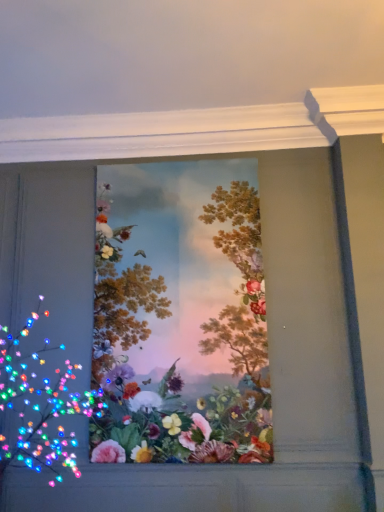
Question: From a real-world perspective, is vibrant floral bouquet at center, the 2th flower when ordered from front to back, over matte floral arrangement at left, which is counted as the first flower, starting from the front?

Choices:
 (A) yes
 (B) no

Answer: (A)

Question: Is vibrant floral bouquet at center, positioned as the 1th flower in back-to-front order, looking in the opposite direction of matte floral arrangement at left, which is the second flower from back to front?

Choices:
 (A) no
 (B) yes

Answer: (A)

Question: Can you confirm if vibrant floral bouquet at center, positioned as the 1th flower in back-to-front order, is wider than matte floral arrangement at left, which is counted as the first flower, starting from the front?

Choices:
 (A) yes
 (B) no

Answer: (B)

Question: Is vibrant floral bouquet at center, the 2th flower when ordered from front to back, at the right side of matte floral arrangement at left, which is the second flower from back to front?

Choices:
 (A) no
 (B) yes

Answer: (B)

Question: Considering the relative sizes of vibrant floral bouquet at center, positioned as the 1th flower in back-to-front order, and matte floral arrangement at left, which is counted as the first flower, starting from the front, in the image provided, is vibrant floral bouquet at center, positioned as the 1th flower in back-to-front order, bigger than matte floral arrangement at left, which is counted as the first flower, starting from the front,?

Choices:
 (A) no
 (B) yes

Answer: (A)

Question: Does vibrant floral bouquet at center, the 2th flower when ordered from front to back, have a smaller size compared to matte floral arrangement at left, which is the second flower from back to front?

Choices:
 (A) yes
 (B) no

Answer: (A)

Question: Would you say matte floral arrangement at left, which is counted as the first flower, starting from the front, is outside vibrant floral bouquet at center, the 2th flower when ordered from front to back?

Choices:
 (A) no
 (B) yes

Answer: (B)

Question: Is matte floral arrangement at left, which is counted as the first flower, starting from the front, looking in the opposite direction of vibrant floral bouquet at center, positioned as the 1th flower in back-to-front order?

Choices:
 (A) no
 (B) yes

Answer: (A)

Question: Is matte floral arrangement at left, which is counted as the first flower, starting from the front, wider than vibrant floral bouquet at center, positioned as the 1th flower in back-to-front order?

Choices:
 (A) yes
 (B) no

Answer: (A)

Question: Is matte floral arrangement at left, which is counted as the first flower, starting from the front, directly adjacent to vibrant floral bouquet at center, the 2th flower when ordered from front to back?

Choices:
 (A) yes
 (B) no

Answer: (B)

Question: Is matte floral arrangement at left, which is the second flower from back to front, smaller than vibrant floral bouquet at center, positioned as the 1th flower in back-to-front order?

Choices:
 (A) no
 (B) yes

Answer: (A)

Question: From a real-world perspective, is matte floral arrangement at left, which is counted as the first flower, starting from the front, positioned over vibrant floral bouquet at center, positioned as the 1th flower in back-to-front order, based on gravity?

Choices:
 (A) yes
 (B) no

Answer: (B)

Question: Would you say matte floral arrangement at left, which is counted as the first flower, starting from the front, is to the left or to the right of vibrant floral bouquet at center, positioned as the 1th flower in back-to-front order, in the picture?

Choices:
 (A) right
 (B) left

Answer: (B)